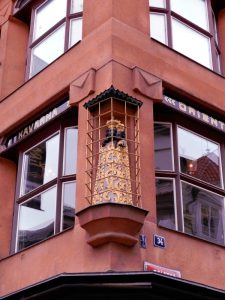
Identify the location of top floor windows. (46, 23), (52, 48), (192, 8), (199, 53).